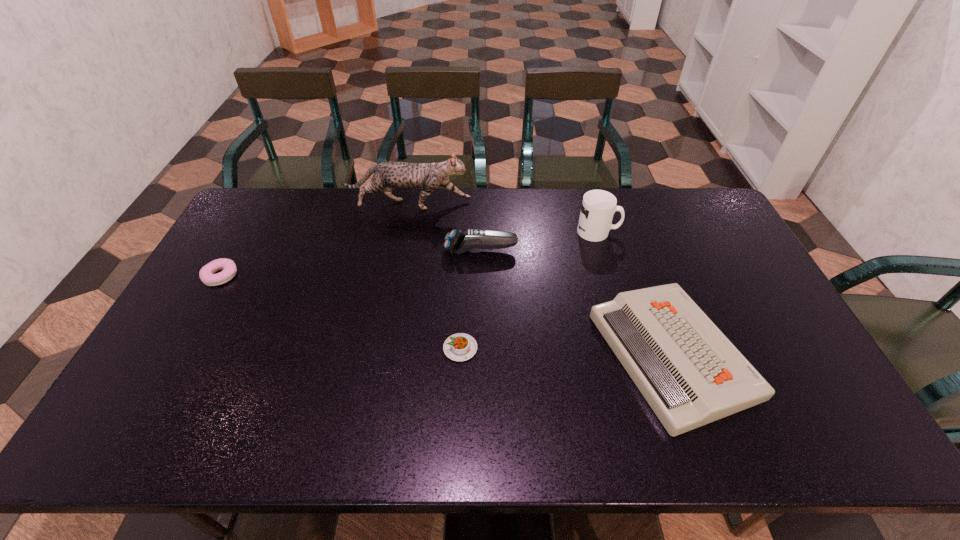
Where is `free point that satisfies the following two spatial constraints: 1. on the face of the farthest object; 2. on the right side of the computer keyboard`? free point that satisfies the following two spatial constraints: 1. on the face of the farthest object; 2. on the right side of the computer keyboard is located at coordinates (381, 354).

Identify the location of free space that satisfies the following two spatial constraints: 1. on the head of the electric shaver; 2. on the left side of the fourth tallest object. (481, 354).

Locate an element on the screen. vacant space that satisfies the following two spatial constraints: 1. on the head of the fourth tallest object; 2. on the left side of the third tallest object is located at coordinates [x=481, y=354].

You are a GUI agent. You are given a task and a screenshot of the screen. Output one action in this format:
    pyautogui.click(x=<x>, y=<y>)
    Task: Click on the vacant space that satisfies the following two spatial constraints: 1. on the head of the computer keyboard; 2. on the left side of the fourth nearest object
    The image size is (960, 540).
    Given the screenshot: What is the action you would take?
    pyautogui.click(x=481, y=354)

Identify the location of vacant space that satisfies the following two spatial constraints: 1. on the head of the computer keyboard; 2. on the right side of the fourth nearest object. The height and width of the screenshot is (540, 960). (481, 354).

The height and width of the screenshot is (540, 960). Find the location of `free point that satisfies the following two spatial constraints: 1. on the face of the tallest object; 2. on the left side of the pudding`. free point that satisfies the following two spatial constraints: 1. on the face of the tallest object; 2. on the left side of the pudding is located at coordinates (382, 348).